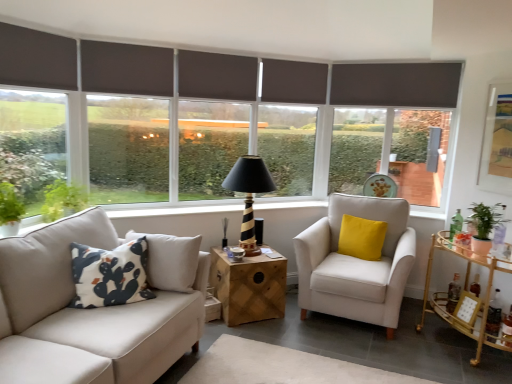
Locate an element on the screen. free space above dark gray roller blind at left, the 2th window from the left (from a real-world perspective) is located at coordinates (128, 41).